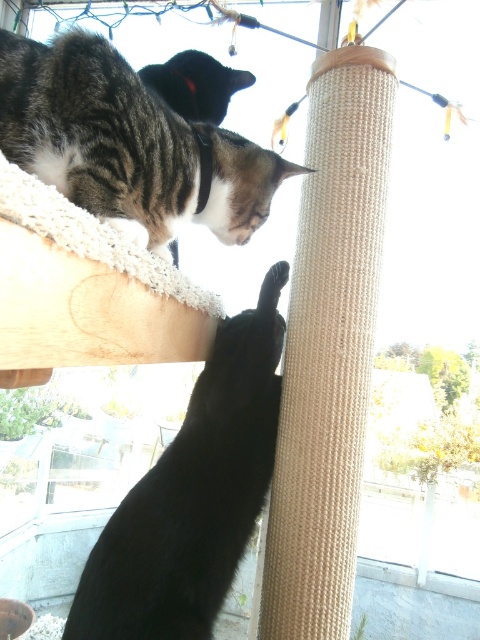
Between black matte cat at upper left and tabby fur cat at upper left, which one is positioned lower?

black matte cat at upper left

Describe the element at coordinates (192, 496) in the screenshot. The height and width of the screenshot is (640, 480). I see `black matte cat at upper left` at that location.

The image size is (480, 640). Identify the location of black matte cat at upper left. (192, 496).